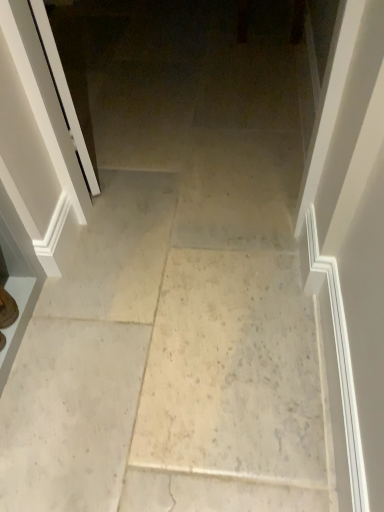
The height and width of the screenshot is (512, 384). Find the location of `matte brown shoe at lower left`. matte brown shoe at lower left is located at coordinates (7, 309).

I want to click on white glossy screen door at left, so click(x=37, y=142).

Is white marble floor at center bigger or smaller than matte brown shoe at lower left?

white marble floor at center is bigger than matte brown shoe at lower left.

From their relative heights in the image, would you say white marble floor at center is taller or shorter than matte brown shoe at lower left?

Considering their sizes, white marble floor at center has less height than matte brown shoe at lower left.

Consider the image. Is white marble floor at center far away from matte brown shoe at lower left?

white marble floor at center is near matte brown shoe at lower left, not far away.

Would you consider white glossy screen door at left to be distant from white marble floor at center?

white glossy screen door at left is actually quite close to white marble floor at center.

Image resolution: width=384 pixels, height=512 pixels. What are the coordinates of `screen door that is above the white marble floor at center (from the image's perspective)` in the screenshot? It's located at (37, 142).

Considering the relative sizes of white glossy screen door at left and white marble floor at center in the image provided, is white glossy screen door at left shorter than white marble floor at center?

No.

Based on the photo, who is bigger, white glossy screen door at left or white marble floor at center?

Bigger between the two is white marble floor at center.

Who is shorter, matte brown shoe at lower left or white marble floor at center?

white marble floor at center is shorter.

From the image's perspective, is matte brown shoe at lower left positioned above or below white marble floor at center?

Clearly, from the image's perspective, matte brown shoe at lower left is above white marble floor at center.

From a real-world perspective, is matte brown shoe at lower left above or below white marble floor at center?

Clearly, from a real-world perspective, matte brown shoe at lower left is above white marble floor at center.

Considering the sizes of objects matte brown shoe at lower left and white marble floor at center in the image provided, who is wider, matte brown shoe at lower left or white marble floor at center?

Wider between the two is white marble floor at center.

Considering the positions of objects matte brown shoe at lower left and white glossy screen door at left in the image provided, who is in front, matte brown shoe at lower left or white glossy screen door at left?

Positioned in front is white glossy screen door at left.

Which of these two, matte brown shoe at lower left or white glossy screen door at left, is smaller?

With smaller size is matte brown shoe at lower left.

Is matte brown shoe at lower left wider or thinner than white glossy screen door at left?

matte brown shoe at lower left is wider than white glossy screen door at left.

Consider the image. From a real-world perspective, is matte brown shoe at lower left located higher than white glossy screen door at left?

No, from a real-world perspective, matte brown shoe at lower left is not over white glossy screen door at left

From the image's perspective, is white marble floor at center positioned above or below white glossy screen door at left?

From the image's perspective, white marble floor at center appears below white glossy screen door at left.

Is the surface of white marble floor at center in direct contact with white glossy screen door at left?

white marble floor at center and white glossy screen door at left are not in contact.

In order to click on screen door that is above the white marble floor at center (from the image's perspective) in this screenshot , I will do `click(37, 142)`.

Is white marble floor at center wider or thinner than white glossy screen door at left?

white marble floor at center is wider than white glossy screen door at left.

In terms of height, does white glossy screen door at left look taller or shorter compared to matte brown shoe at lower left?

In the image, white glossy screen door at left appears to be taller than matte brown shoe at lower left.

Do you think white glossy screen door at left is within matte brown shoe at lower left, or outside of it?

white glossy screen door at left is spatially situated outside matte brown shoe at lower left.

Which object is positioned more to the left, white glossy screen door at left or matte brown shoe at lower left?

matte brown shoe at lower left.

From a real-world perspective, is white glossy screen door at left physically located above or below matte brown shoe at lower left?

From a real-world perspective, white glossy screen door at left is physically above matte brown shoe at lower left.

There is a white marble floor at center. Identify the location of footwear above it (from a real-world perspective). The width and height of the screenshot is (384, 512). (7, 309).

Locate an element on the screen. This screenshot has width=384, height=512. screen door that is on the left side of white marble floor at center is located at coordinates (37, 142).

When comparing their distances from matte brown shoe at lower left, does white marble floor at center or white glossy screen door at left seem closer?

The object closer to matte brown shoe at lower left is white glossy screen door at left.

From the picture: Which object lies nearer to the anchor point white marble floor at center, white glossy screen door at left or matte brown shoe at lower left?

Based on the image, white glossy screen door at left appears to be nearer to white marble floor at center.

Estimate the real-world distances between objects in this image. Which object is further from white glossy screen door at left, white marble floor at center or matte brown shoe at lower left?

white marble floor at center lies further to white glossy screen door at left than the other object.

Looking at the image, which one is located closer to white marble floor at center, matte brown shoe at lower left or white glossy screen door at left?

white glossy screen door at left.

Estimate the real-world distances between objects in this image. Which object is closer to white glossy screen door at left, matte brown shoe at lower left or white marble floor at center?

matte brown shoe at lower left is positioned closer to the anchor white glossy screen door at left.

Looking at the image, which one is located further to matte brown shoe at lower left, white glossy screen door at left or white marble floor at center?

Based on the image, white marble floor at center appears to be further to matte brown shoe at lower left.

Find the location of a particular element. The height and width of the screenshot is (512, 384). footwear between white glossy screen door at left and white marble floor at center in the vertical direction is located at coordinates (7, 309).